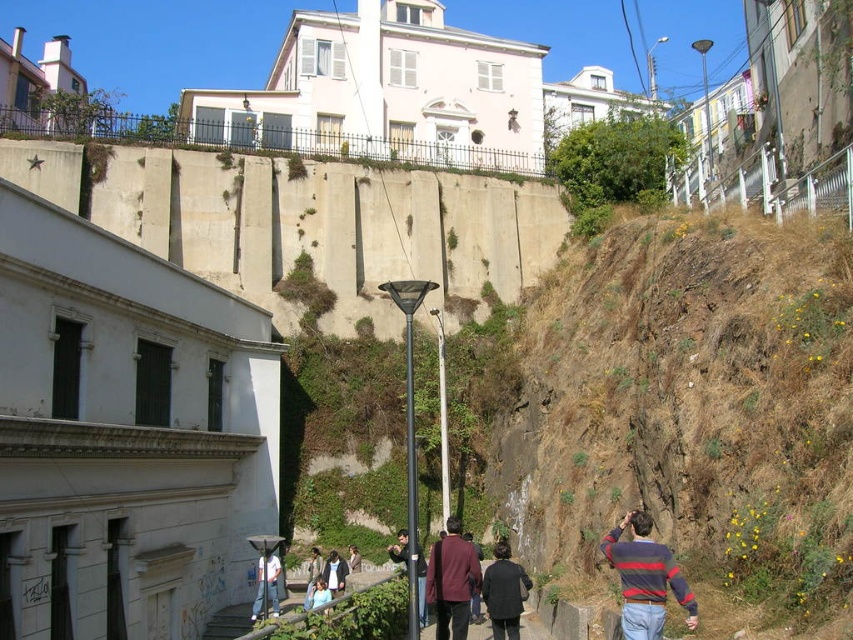
Between dark gray coat at lower right and dark blue denim jacket at lower center, which one appears on the right side from the viewer's perspective?

dark gray coat at lower right

Is dark gray coat at lower right taller than dark blue denim jacket at lower center?

Correct, dark gray coat at lower right is much taller as dark blue denim jacket at lower center.

Find the location of a particular element. dark gray coat at lower right is located at coordinates (503, 593).

This screenshot has width=853, height=640. I want to click on dark gray coat at lower right, so click(503, 593).

Consider the image. Who is lower down, striped sweater at lower right or maroon fabric coat at center?

maroon fabric coat at center is below.

The height and width of the screenshot is (640, 853). What do you see at coordinates (645, 579) in the screenshot? I see `striped sweater at lower right` at bounding box center [645, 579].

Which is behind, point (642, 596) or point (466, 554)?

The point (466, 554) is behind.

Where is `striped sweater at lower right`? The width and height of the screenshot is (853, 640). striped sweater at lower right is located at coordinates pyautogui.click(x=645, y=579).

Consider the image. Between maroon fabric coat at center and dark blue jeans at lower center, which one has less height?

With less height is dark blue jeans at lower center.

The height and width of the screenshot is (640, 853). Describe the element at coordinates (451, 580) in the screenshot. I see `maroon fabric coat at center` at that location.

Locate an element on the screen. The width and height of the screenshot is (853, 640). maroon fabric coat at center is located at coordinates (451, 580).